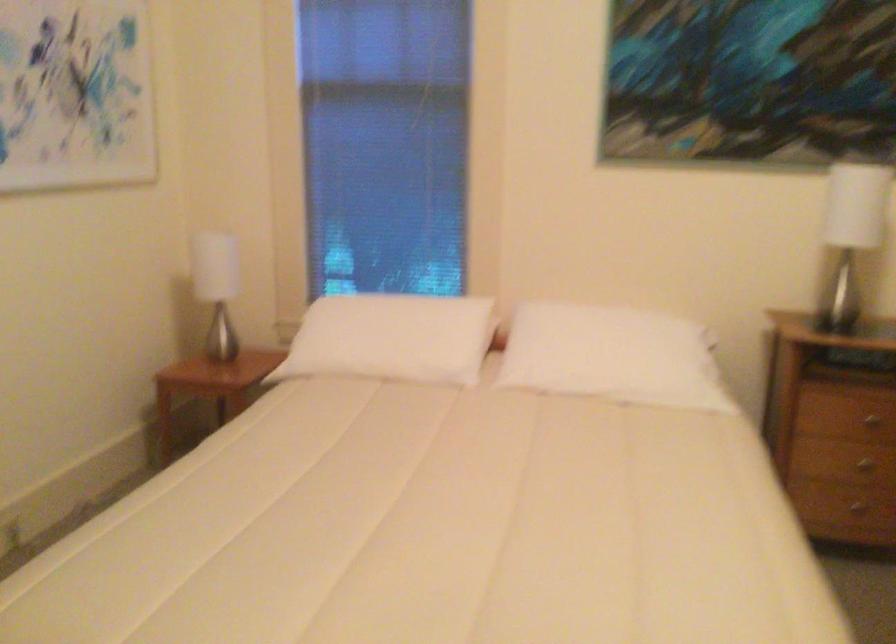
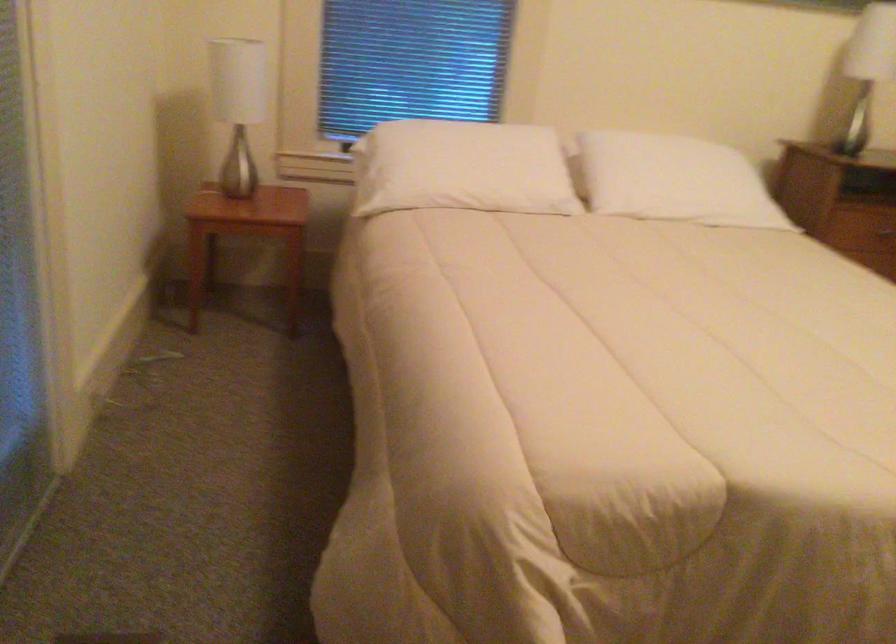
Locate, in the second image, the point that corresponds to the point at 365,345 in the first image.

(462, 167)